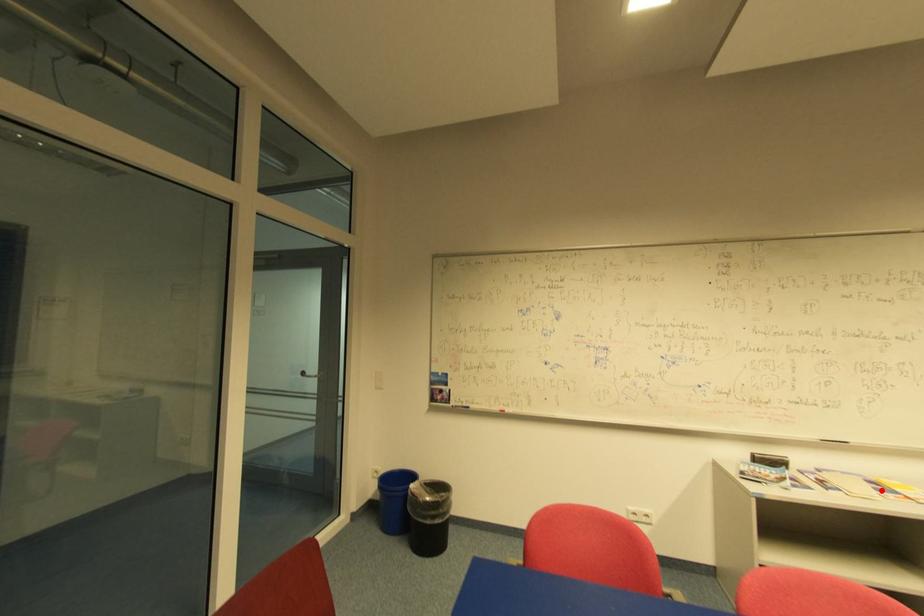
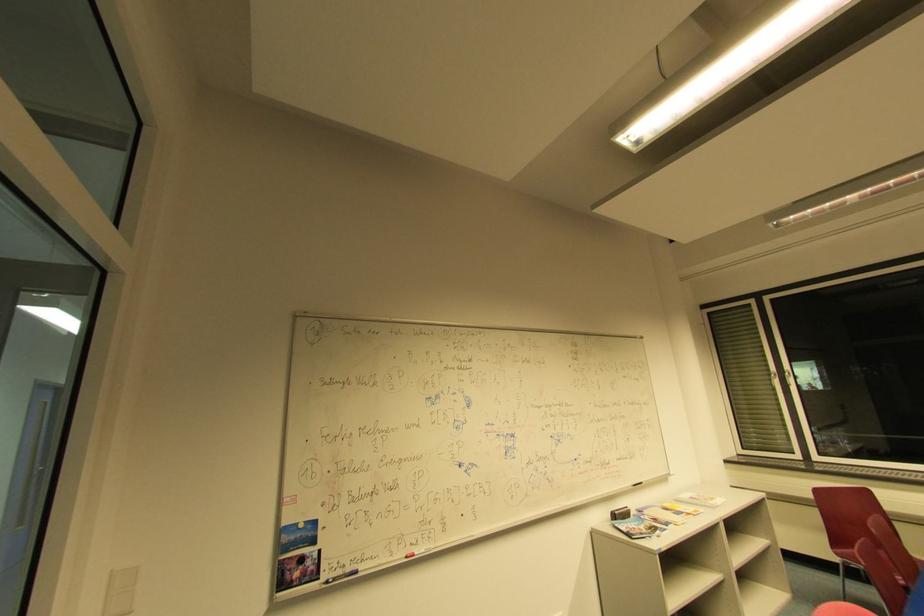
Question: I am providing you with two images of the same scene from different viewpoints. A red point is shown in image1. For the corresponding object point in image2, is it positioned nearer or farther from the camera?

Choices:
 (A) Nearer
 (B) Farther

Answer: (B)